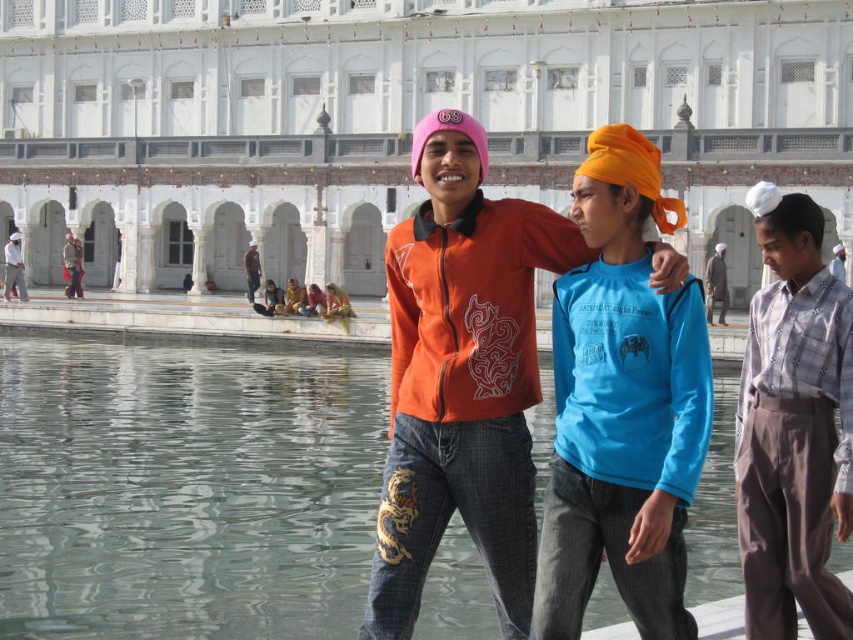
Question: Is orange fabric turban at center closer to camera compared to matte black turban at center?

Choices:
 (A) no
 (B) yes

Answer: (B)

Question: Which is farther from the orange fleece jacket at center?

Choices:
 (A) clear glass pool at center
 (B) light brown woolen turban at center
 (C) blue fabric sari at center
 (D) yellow fabric sari at center

Answer: (D)

Question: Observing the image, what is the correct spatial positioning of yellow fabric sari at center in reference to white cotton turban at center?

Choices:
 (A) right
 (B) left

Answer: (B)

Question: Which object is farther from the camera taking this photo?

Choices:
 (A) light pink fabric headscarf at center
 (B) orange fleece jacket at center
 (C) clear glass pool at center
 (D) matte black shirt at center

Answer: (D)

Question: Does light brown woolen turban at center appear over matte black turban at center?

Choices:
 (A) no
 (B) yes

Answer: (A)

Question: Which point is farther to the camera?

Choices:
 (A) (648, 179)
 (B) (259, 262)

Answer: (B)